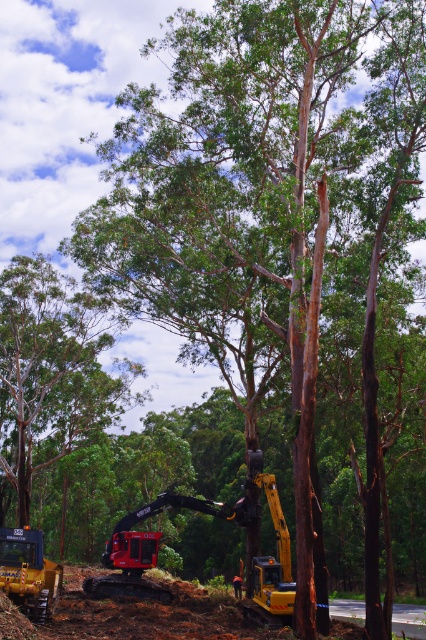
You are a forester assessing the area. You need to determine which object is larger between the green rough bark tree at upper left and the yellow rubber tracked excavator at lower left. Based on the scene, which one is larger?

The green rough bark tree at upper left is bigger than the yellow rubber tracked excavator at lower left according to the description.

You are a drone operator flying above a deforestation site. Your mission is to locate a specific point marked at coordinates point (51, 374). Based on the scene description, where exactly would this point be located?

The point (51, 374) is on the green rough bark tree at upper left.

You are a drone operator assigned to monitor deforestation activities. Your drone is currently positioned at the camera location. The green rough bark tree at upper left is part of a protected area. To ensure compliance, you need to maintain a minimum distance of 50 meters from protected trees. Is your current position compliant with this regulation?

The distance between the green rough bark tree at upper left and the camera is 45.71 meters, which is less than the required 50 meters. Therefore, the current position is not compliant with the regulation.